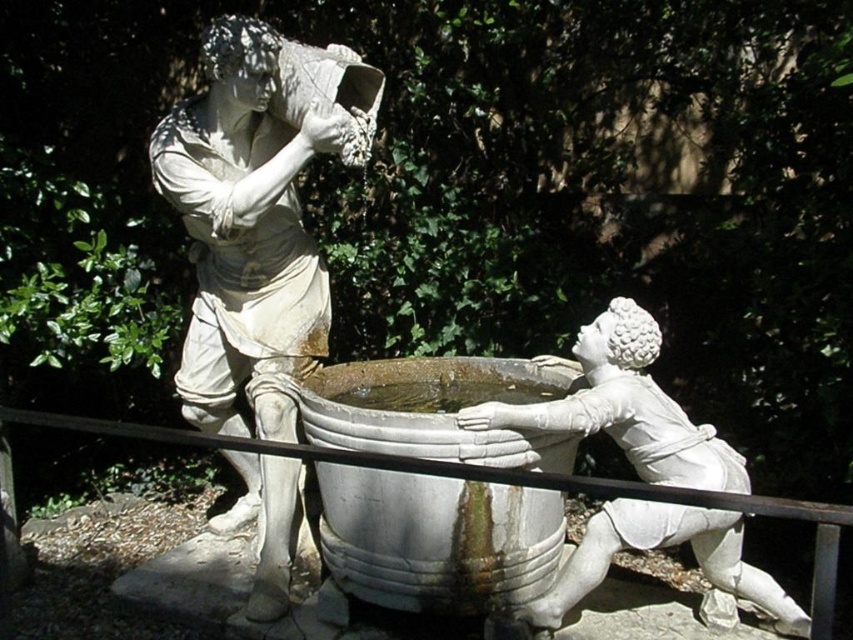
You are standing in the garden where the sculpture is located. You want to take a photo of the white marble boy at lower right. Where should you position yourself to capture the boy in the frame?

To capture the white marble boy at lower right in your photo, position yourself so that your camera is aimed at the coordinates point (x=624, y=406), which marks the location of the boy in the sculpture.

Based on the scene description, which object is larger in size between the white stone basin at center and the white marble boy at lower right?

The white stone basin at center is bigger than the white marble boy at lower right according to the description.

You are an art conservator assessing the spatial arrangement of the statues in the sculpture. Given that the white stone statue at left is narrower than the white marble boy at lower right, which statue would require more horizontal space to accommodate its width?

The white marble boy at lower right requires more horizontal space since its width is greater than the white stone statue at left.